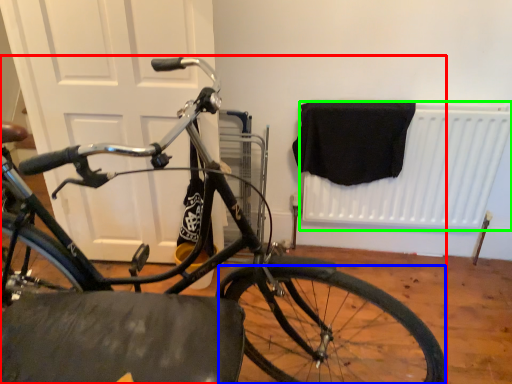
Question: Which is farther away from bicycle (highlighted by a red box)? bicycle wheel (highlighted by a blue box) or radiator (highlighted by a green box)?

Choices:
 (A) bicycle wheel
 (B) radiator

Answer: (B)